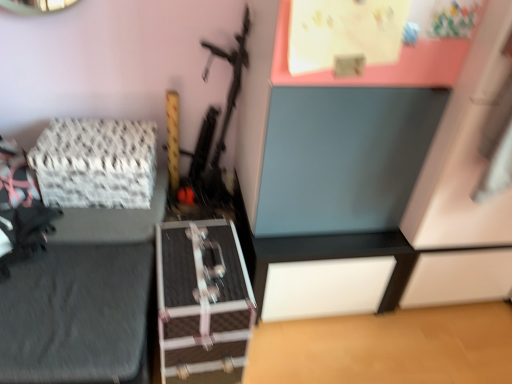
The height and width of the screenshot is (384, 512). What are the coordinates of `vacant area that is in front of white woven fabric at left` in the screenshot? It's located at (103, 222).